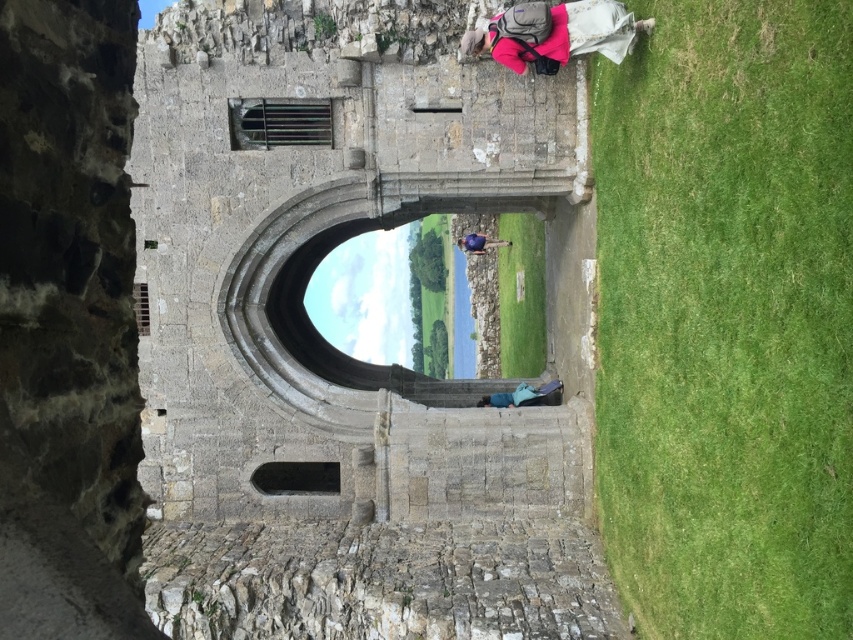
You are an explorer carrying a pink fabric backpack at upper right and a blue fabric bag at lower center. You need to pass through a narrow stone archway. Which item has a greater width that might make it harder to fit through the archway?

The pink fabric backpack at upper right has a greater width than the blue fabric bag at lower center, so it might be harder to fit through the narrow stone archway.

You are standing inside the stone archway and want to place your pink fabric backpack at upper right in a specific spot. According to the coordinates given, where exactly should you place it?

The pink fabric backpack at upper right should be placed at the 2D coordinates point (590, 29).

Consider the image. You are an explorer carrying a blue fabric bag at lower center and a blue fabric at center. You need to pack your items. Which item can hold more items based on their size?

The blue fabric at center can hold more items because it has a larger size compared to the blue fabric bag at lower center.